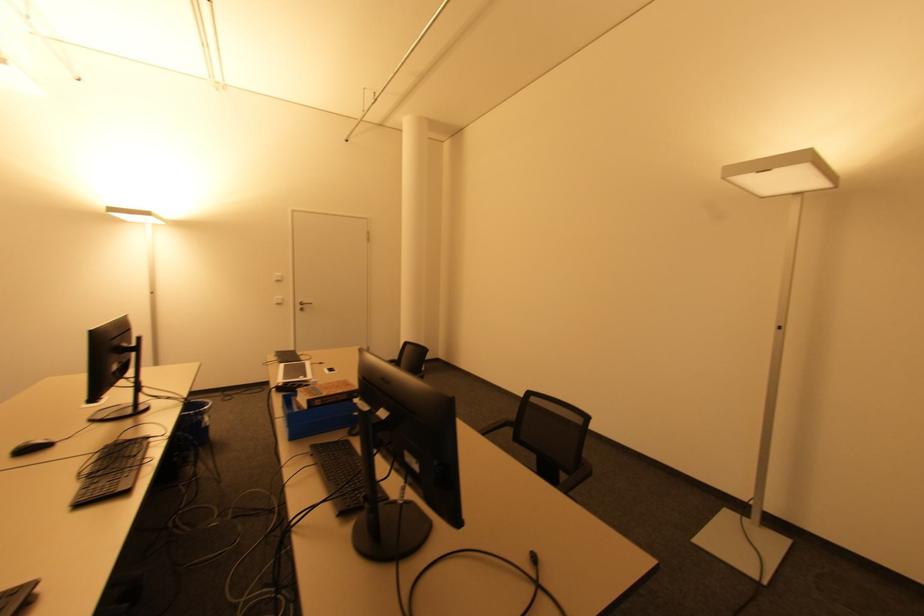
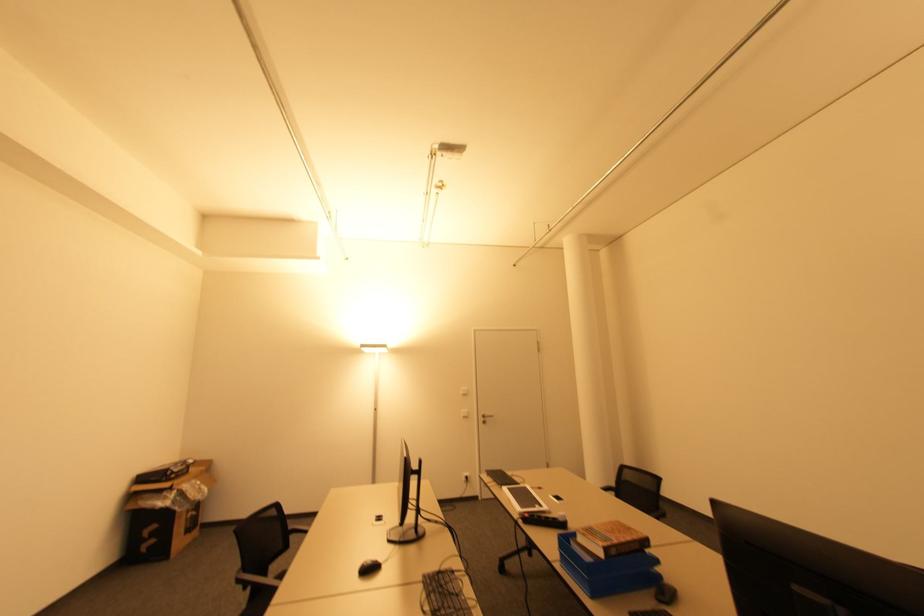
Where in the second image is the point corresponding to [294,439] from the first image?

(594, 597)